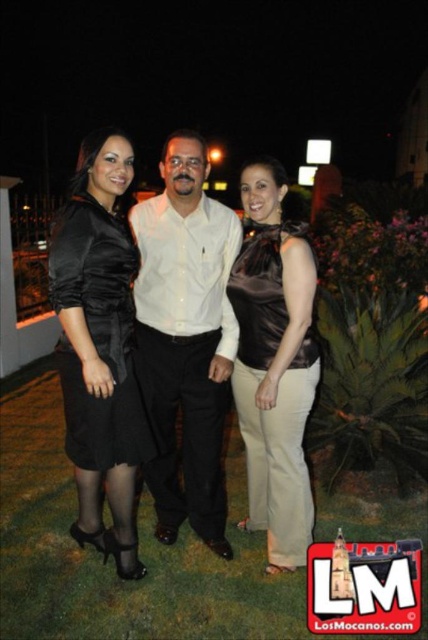
You are a photographer adjusting the camera settings for a group photo. You notice the satin black dress at left and the satin brown top at center. Which clothing item should you focus on first if you want to ensure both are in focus, considering their positions?

The satin black dress at left should be focused on first since it is located above the satin brown top at center, allowing the depth of field to cover both items effectively.

Looking at this image, you are a photographer standing 10 feet away from the camera position. You want to adjust your position so that you can clearly see the details of the satin black dress at center. Should you move closer or farther away?

The satin black dress at center is currently 8.31 feet away from the camera. Since you are standing 10 feet away from the camera position, you are farther than the dress. To see the details clearly, you should move closer to the dress so that you are within the same distance as the camera was.